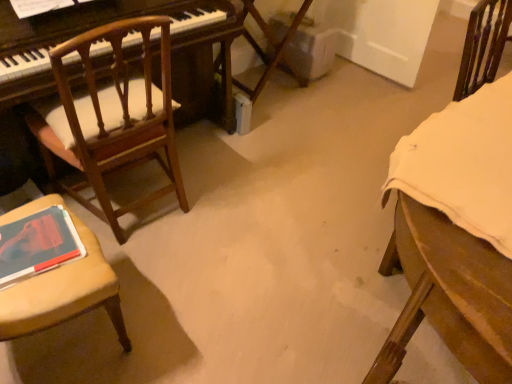
Question: Considering their positions, is wooden chair at right, marked as the first chair in a right-to-left arrangement, located in front of or behind matte red book at lower left?

Choices:
 (A) front
 (B) behind

Answer: (A)

Question: Is point (464, 59) positioned closer to the camera than point (15, 223)?

Choices:
 (A) closer
 (B) farther

Answer: (B)

Question: Which object is the closest to the wooden chair with cushion at left, marked as the 2th chair in a left-to-right arrangement?

Choices:
 (A) matte red book at lower left
 (B) wooden chair with cushion at left, the 3th chair in the right-to-left sequence
 (C) wooden chair at right, which appears as the third chair when viewed from the left

Answer: (B)

Question: Which is nearer to the matte red book at lower left?

Choices:
 (A) wooden chair with cushion at left, the 3th chair in the right-to-left sequence
 (B) wooden chair with cushion at left, arranged as the 2th chair when viewed from the right
 (C) wooden chair at right, marked as the first chair in a right-to-left arrangement

Answer: (A)